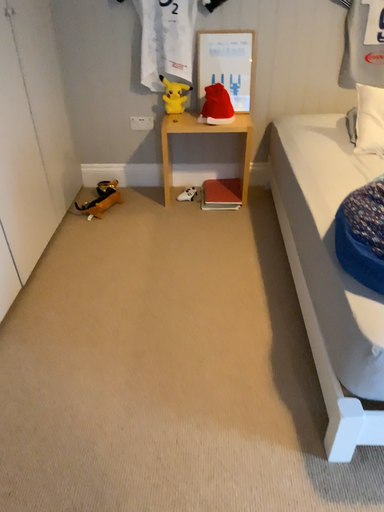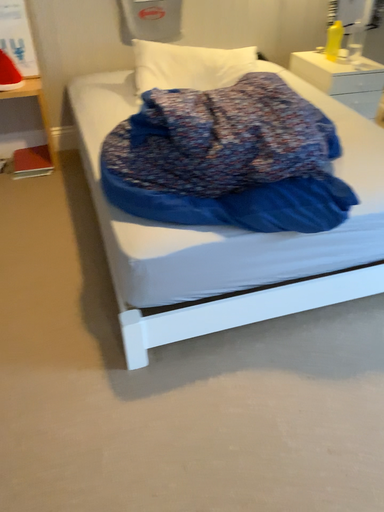
Question: How did the camera likely rotate when shooting the video?

Choices:
 (A) rotated right
 (B) rotated left

Answer: (A)